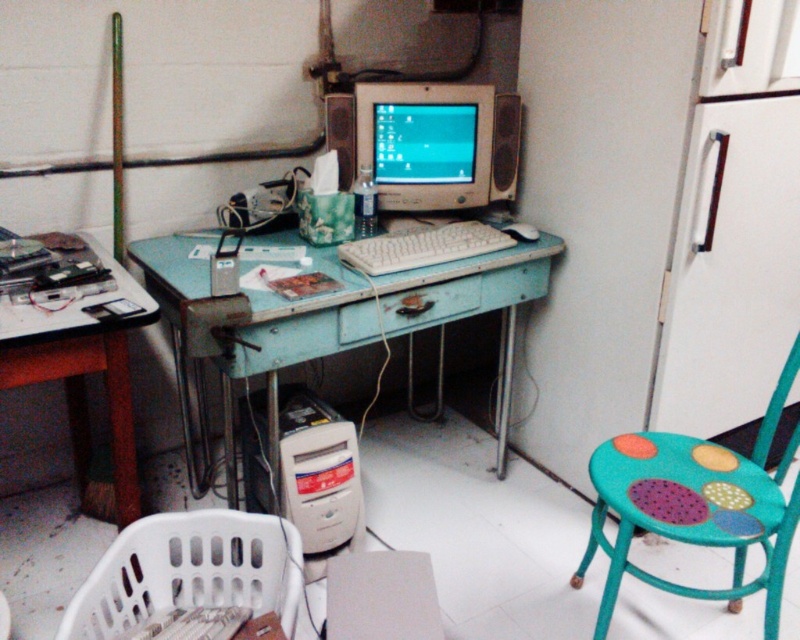
You are trying to reach the white plastic keyboard at center from the teal painted wood stool at right. Which direction do you need to move relative to the stool?

To reach the white plastic keyboard at center from the teal painted wood stool at right, you would need to move towards the center since the stool is closer to the viewer than the keyboard.

You are standing at the entrance of the workspace and want to move towards the desk. There are two points marked in the image. Which point, point (x=541, y=236) or point (x=786, y=396), is closer to your current position?

Point (x=786, y=396) is closer to your current position because it is in front of point (x=541, y=236).

You are standing in the workspace described. You see a point at coordinates (x=328, y=316). What object is located at that point?

The point at coordinates (x=328, y=316) corresponds to the teal painted wood desk at center.